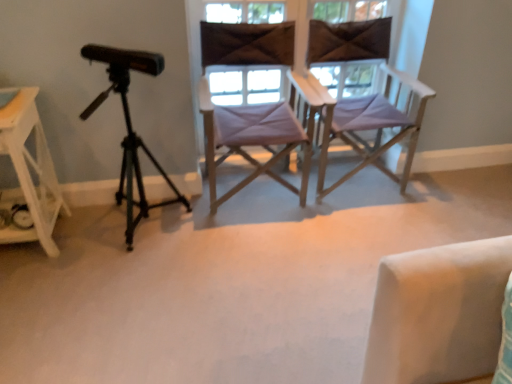
Question: Could brown fabric at center, positioned as the second window in right-to-left order, be considered to be inside black matte tripod at left?

Choices:
 (A) yes
 (B) no

Answer: (B)

Question: Is black matte tripod at left looking in the opposite direction of brown fabric at center, arranged as the 1th window when viewed from the left?

Choices:
 (A) yes
 (B) no

Answer: (B)

Question: Can you confirm if black matte tripod at left is smaller than brown fabric at center, arranged as the 1th window when viewed from the left?

Choices:
 (A) no
 (B) yes

Answer: (A)

Question: Considering the relative sizes of black matte tripod at left and brown fabric at center, arranged as the 1th window when viewed from the left, in the image provided, is black matte tripod at left bigger than brown fabric at center, arranged as the 1th window when viewed from the left,?

Choices:
 (A) no
 (B) yes

Answer: (B)

Question: Does black matte tripod at left have a greater width compared to brown fabric at center, arranged as the 1th window when viewed from the left?

Choices:
 (A) yes
 (B) no

Answer: (A)

Question: Is purple fabric chair at center, which is the 2th chair from left to right, taller or shorter than white wood side table at left?

Choices:
 (A) tall
 (B) short

Answer: (A)

Question: In the image, is purple fabric chair at center, which is the 2th chair from left to right, on the left side or the right side of white wood side table at left?

Choices:
 (A) left
 (B) right

Answer: (B)

Question: Relative to white wood side table at left, is purple fabric chair at center, placed as the first chair when sorted from right to left, in front or behind?

Choices:
 (A) front
 (B) behind

Answer: (B)

Question: Looking at their shapes, would you say purple fabric chair at center, placed as the first chair when sorted from right to left, is wider or thinner than white wood side table at left?

Choices:
 (A) wide
 (B) thin

Answer: (A)

Question: In terms of width, does purple fabric chair at center, arranged as the first chair when viewed from the left, look wider or thinner when compared to matte purple chair at center, which ranks as the 1th window in right-to-left order?

Choices:
 (A) thin
 (B) wide

Answer: (B)

Question: Does point (240, 125) appear closer or farther from the camera than point (220, 87)?

Choices:
 (A) farther
 (B) closer

Answer: (B)

Question: From a real-world perspective, is purple fabric chair at center, arranged as the first chair when viewed from the left, physically located above or below matte purple chair at center, which ranks as the 1th window in right-to-left order?

Choices:
 (A) below
 (B) above

Answer: (A)

Question: Considering the positions of purple fabric chair at center, arranged as the first chair when viewed from the left, and matte purple chair at center, placed as the 2th window when sorted from left to right, in the image, is purple fabric chair at center, arranged as the first chair when viewed from the left, bigger or smaller than matte purple chair at center, placed as the 2th window when sorted from left to right,?

Choices:
 (A) small
 (B) big

Answer: (B)

Question: In terms of height, does brown fabric at center, positioned as the second window in right-to-left order, look taller or shorter compared to matte purple chair at center, placed as the 2th window when sorted from left to right?

Choices:
 (A) short
 (B) tall

Answer: (A)

Question: From the image's perspective, is brown fabric at center, arranged as the 1th window when viewed from the left, located above or below matte purple chair at center, which ranks as the 1th window in right-to-left order?

Choices:
 (A) above
 (B) below

Answer: (B)